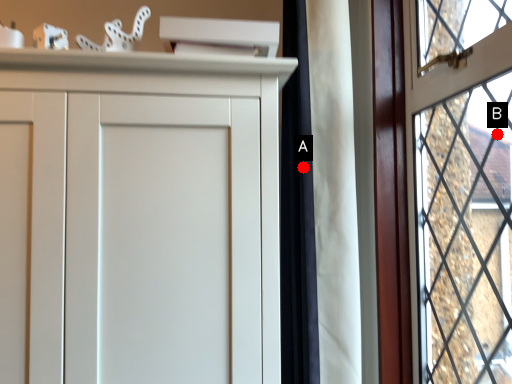
Question: Two points are circled on the image, labeled by A and B beside each circle. Which point is closer to the camera?

Choices:
 (A) A is closer
 (B) B is closer

Answer: (A)